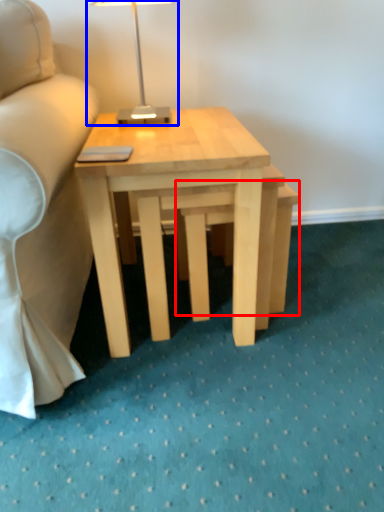
Question: Which object is closer to the camera taking this photo, step stool (highlighted by a red box) or table lamp (highlighted by a blue box)?

Choices:
 (A) step stool
 (B) table lamp

Answer: (B)